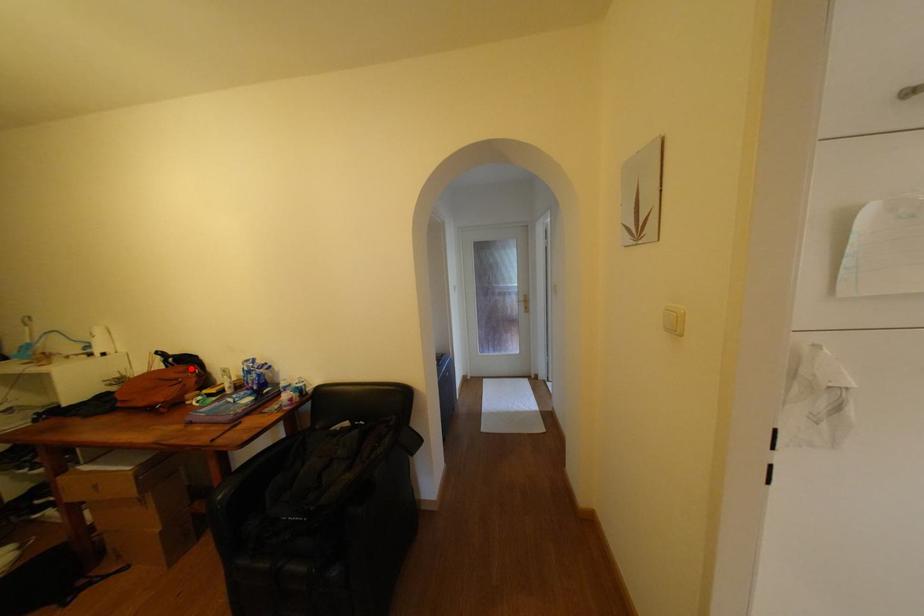
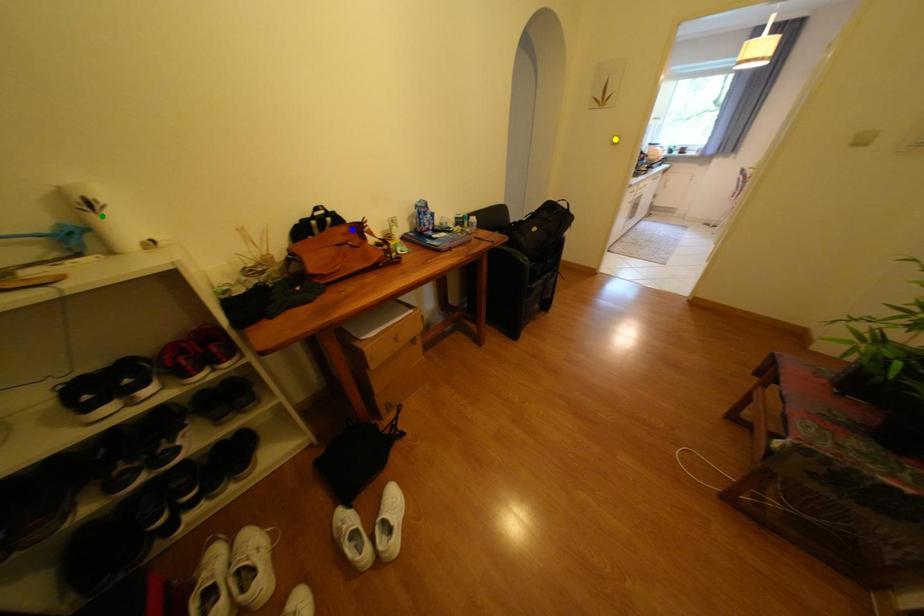
Question: I am providing you with two images of the same scene from different viewpoints. A red point is marked on the first image. You are given multiple points on the second image. Which mark in image 2 goes with the point in image 1?

Choices:
 (A) yellow point
 (B) green point
 (C) blue point

Answer: (C)